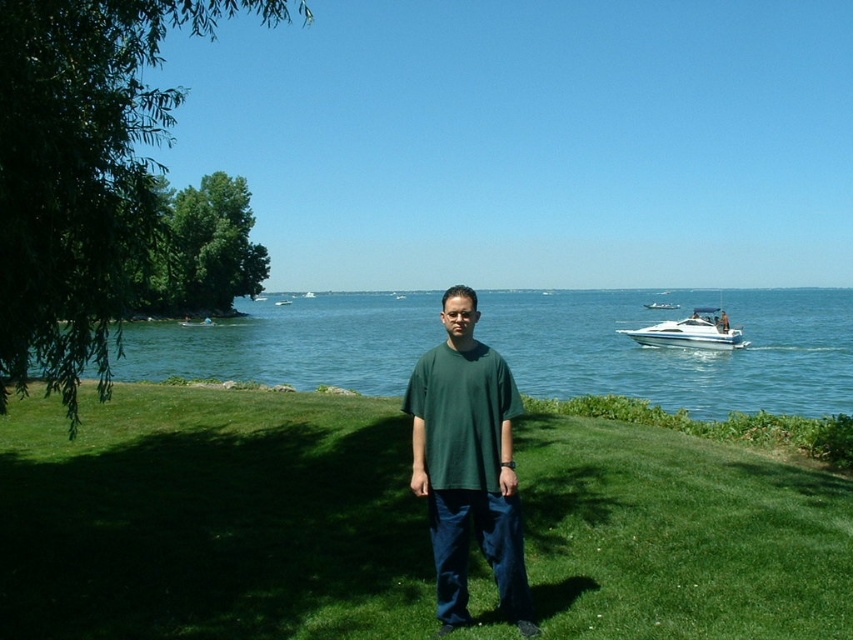
Question: Which object is the closest to the green grass at center?

Choices:
 (A) white glossy boat at center
 (B) green matte t-shirt at center
 (C) white glossy speedboat at right
 (D) blue water at center

Answer: (B)

Question: Which of the following is the closest to the observer?

Choices:
 (A) (560, 385)
 (B) (695, 332)
 (C) (422, 403)

Answer: (C)

Question: Among these points, which one is nearest to the camera?

Choices:
 (A) (169, 602)
 (B) (660, 340)

Answer: (A)

Question: Can you confirm if green grass at center is positioned below white glossy boat at upper right?

Choices:
 (A) no
 (B) yes

Answer: (B)

Question: Can you confirm if green grass at center is positioned to the left of green matte t-shirt at center?

Choices:
 (A) yes
 (B) no

Answer: (A)

Question: Can you confirm if white glossy boat at upper right is positioned above white glossy boat at center?

Choices:
 (A) yes
 (B) no

Answer: (B)